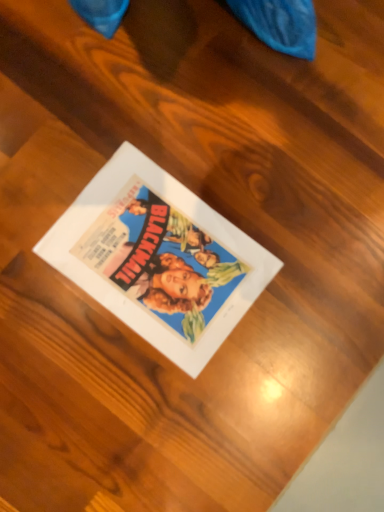
Question: Should I look upward or downward to see matte paper poster at center?

Choices:
 (A) up
 (B) down

Answer: (B)